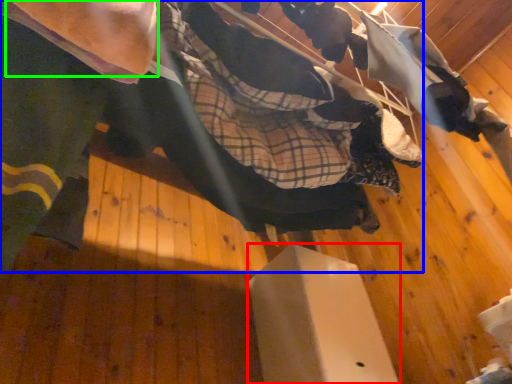
Question: Considering the real-world distances, which object is closest to furniture (highlighted by a red box)? skateboarder (highlighted by a blue box) or arm (highlighted by a green box).

Choices:
 (A) skateboarder
 (B) arm

Answer: (A)